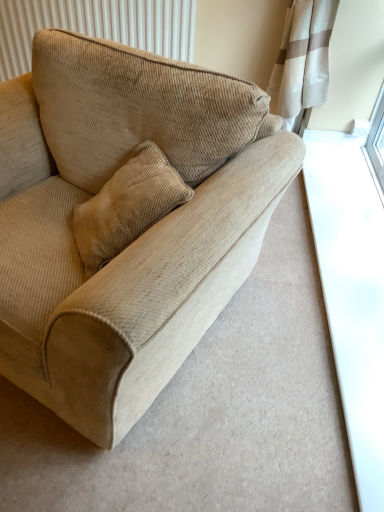
Question: Based on their sizes in the image, would you say beige corduroy couch at center is bigger or smaller than beige corduroy radiator at upper left?

Choices:
 (A) small
 (B) big

Answer: (B)

Question: From the image's perspective, is beige corduroy couch at center positioned above or below beige corduroy radiator at upper left?

Choices:
 (A) below
 (B) above

Answer: (A)

Question: Is beige corduroy couch at center to the left or to the right of beige corduroy radiator at upper left in the image?

Choices:
 (A) right
 (B) left

Answer: (A)

Question: Considering the positions of beige corduroy radiator at upper left and beige corduroy couch at center in the image, is beige corduroy radiator at upper left wider or thinner than beige corduroy couch at center?

Choices:
 (A) wide
 (B) thin

Answer: (B)

Question: Considering the positions of beige corduroy radiator at upper left and beige corduroy couch at center in the image, is beige corduroy radiator at upper left bigger or smaller than beige corduroy couch at center?

Choices:
 (A) big
 (B) small

Answer: (B)

Question: In the image, is beige corduroy radiator at upper left positioned in front of or behind beige corduroy couch at center?

Choices:
 (A) behind
 (B) front

Answer: (A)

Question: Considering the positions of beige corduroy radiator at upper left and beige corduroy couch at center in the image, is beige corduroy radiator at upper left taller or shorter than beige corduroy couch at center?

Choices:
 (A) short
 (B) tall

Answer: (A)